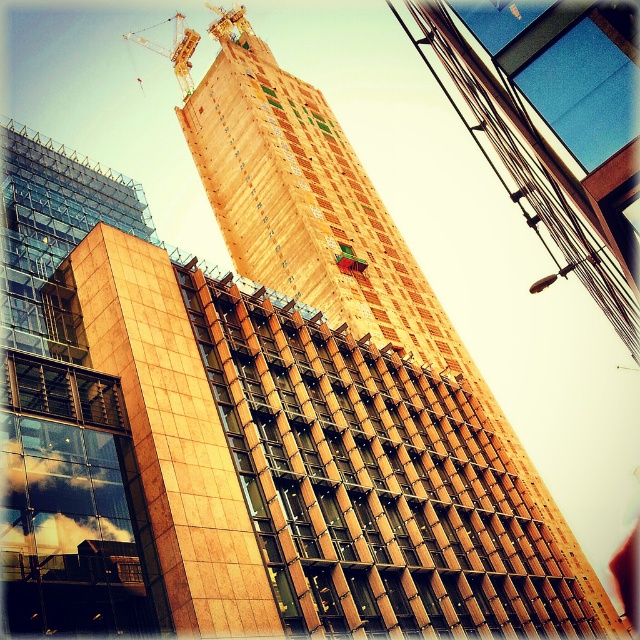
Does brown textured building at center have a greater height compared to metallic yellow crane at upper left?

Indeed, brown textured building at center has a greater height compared to metallic yellow crane at upper left.

Is point (522, 476) farther from camera compared to point (124, 35)?

No, (522, 476) is closer to viewer.

At what (x,y) coordinates should I click in order to perform the action: click on brown textured building at center. Please return your answer as a coordinate pair (x, y). The width and height of the screenshot is (640, 640). Looking at the image, I should click on (337, 243).